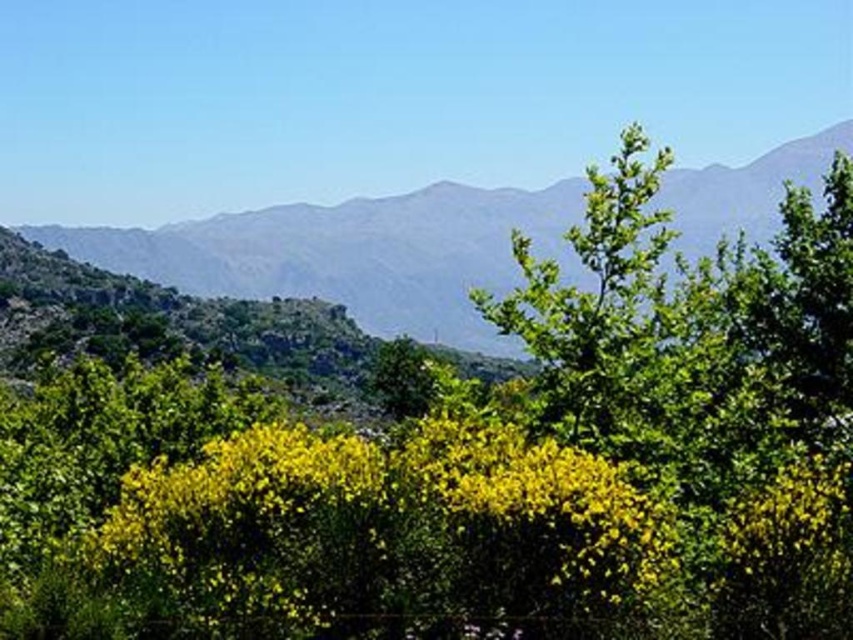
Question: Where is green textured mountain at center located in relation to green leafy tree at center in the image?

Choices:
 (A) right
 (B) left

Answer: (B)

Question: Which of the following is the closest to the observer?

Choices:
 (A) green textured mountain at center
 (B) green leafy tree at center

Answer: (B)

Question: Can you confirm if green textured mountain at center is positioned to the right of green leafy tree at center?

Choices:
 (A) yes
 (B) no

Answer: (B)

Question: Can you confirm if green textured mountain at center is thinner than green leafy tree at center?

Choices:
 (A) no
 (B) yes

Answer: (A)